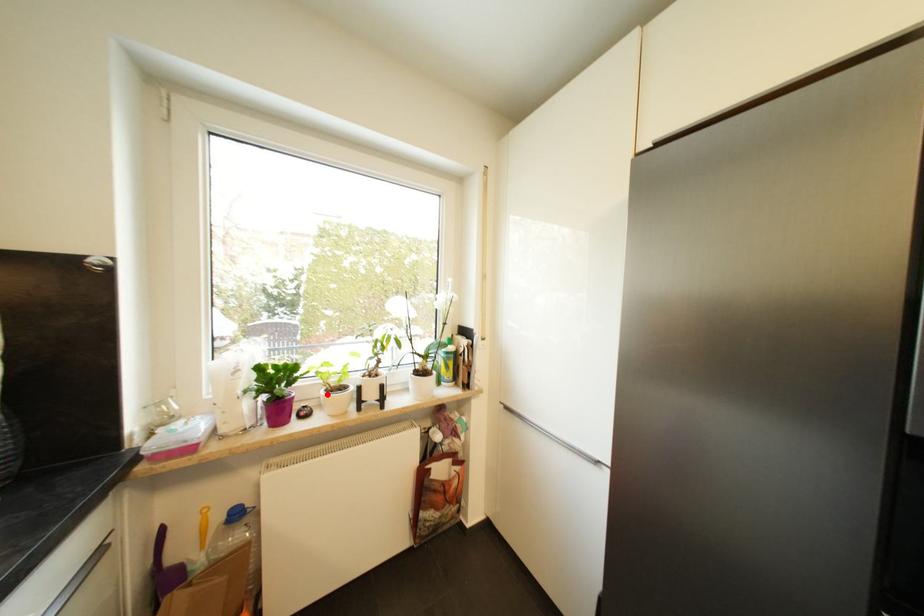
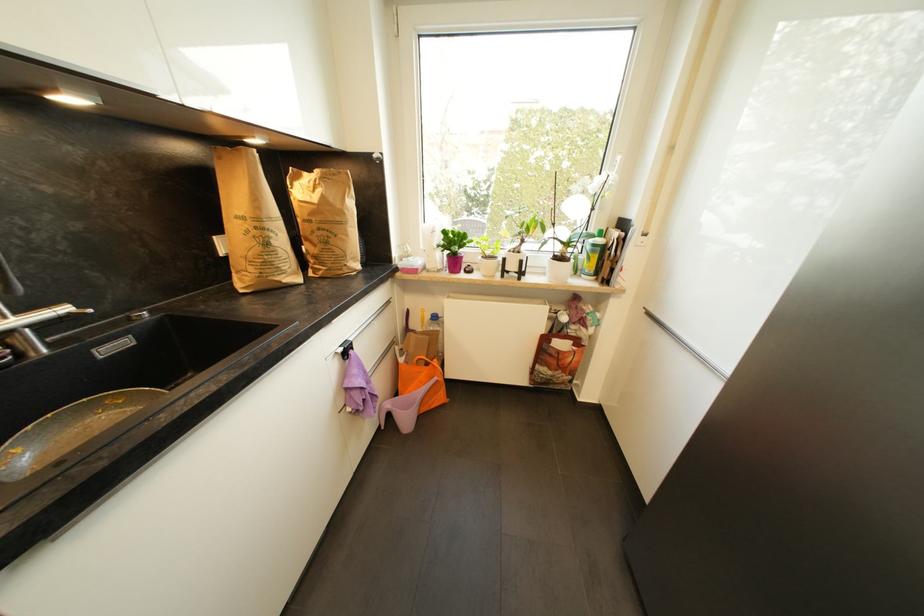
Question: I am providing you with two images of the same scene from different viewpoints. Image1 has a red point marked. In image2, the corresponding 3D location appears at what relative position? Reply with the corresponding letter.

Choices:
 (A) Closer
 (B) Farther

Answer: (A)